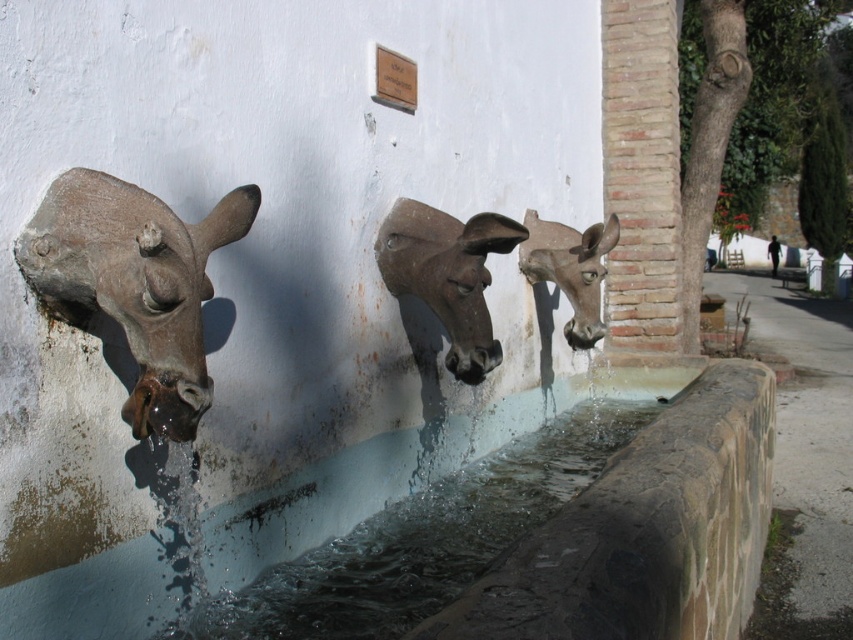
Question: Is rustic stone donkey head at center smaller than matte gray donkey head at center?

Choices:
 (A) yes
 (B) no

Answer: (B)

Question: Which point appears closest to the camera in this image?

Choices:
 (A) (572, 257)
 (B) (96, 305)
 (C) (456, 593)

Answer: (B)

Question: Which of the following is the closest to the observer?

Choices:
 (A) coord(554,268)
 (B) coord(454,525)

Answer: (B)

Question: Which of the following is the farthest from the observer?

Choices:
 (A) pyautogui.click(x=171, y=300)
 (B) pyautogui.click(x=489, y=320)
 (C) pyautogui.click(x=547, y=499)

Answer: (C)

Question: Is clear liquid water at center to the left of rustic stone donkey head at center from the viewer's perspective?

Choices:
 (A) yes
 (B) no

Answer: (B)

Question: Is rustic stone donkey head at center closer to camera compared to matte gray donkey head at center?

Choices:
 (A) no
 (B) yes

Answer: (B)